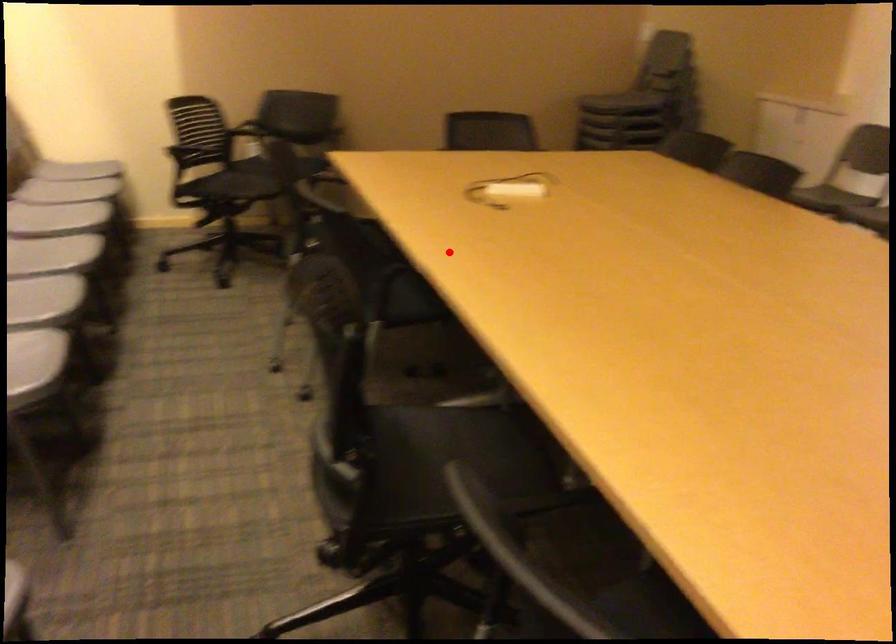
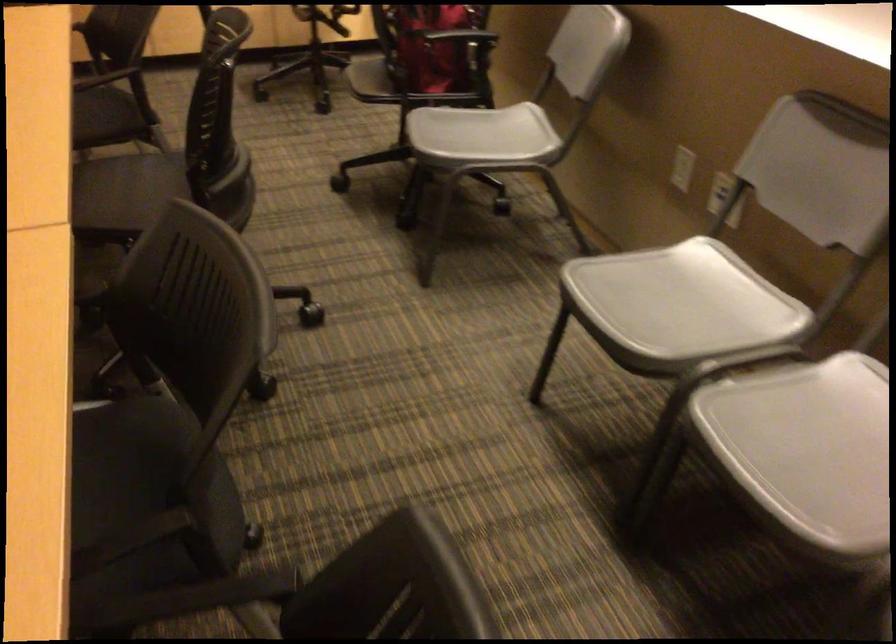
Question: A red point is marked in image1. In image2, is the corresponding 3D point closer to the camera or farther? Reply with the corresponding letter.

Choices:
 (A) The corresponding 3D point is closer.
 (B) The corresponding 3D point is farther.

Answer: (A)